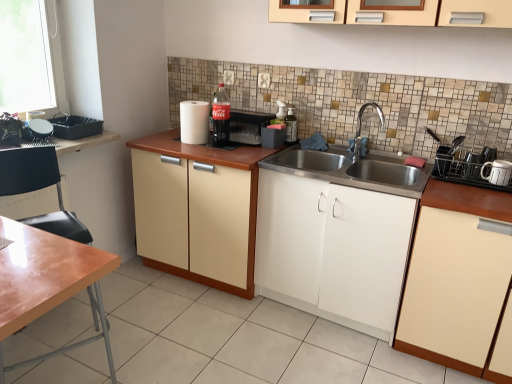
Where is `blank area to the left of black plastic toaster at right, the 5th appliance from the left`? The height and width of the screenshot is (384, 512). blank area to the left of black plastic toaster at right, the 5th appliance from the left is located at coordinates (448, 180).